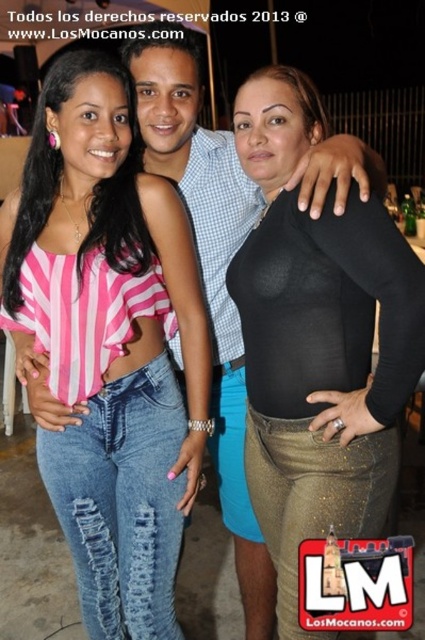
You are a photographer adjusting your camera settings to focus on the black matte bodysuit at center and the pink striped fabric top at upper left. Which one should you focus on first to ensure proper depth of field?

A: The pink striped fabric top at upper left is closer to the viewer than the black matte bodysuit at center, so you should focus on the pink striped fabric top at upper left first to ensure proper depth of field.

You are a photographer adjusting your camera settings to focus on two specific points in the image. The first point is point (x=85, y=240) and the second is point (x=376, y=294). Which point should you focus on first to ensure the closest subject is in sharp focus?

Point (x=85, y=240) is closer to the camera than point (x=376, y=294), so you should focus on point (x=85, y=240) first to ensure the closest subject is in sharp focus.